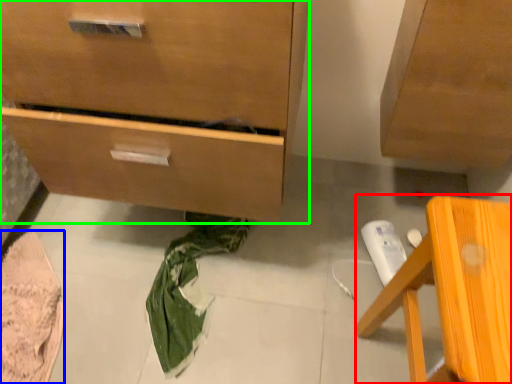
Question: Which object is the farthest from furniture (highlighted by a red box)? Choose among these: material (highlighted by a blue box) or chest of drawers (highlighted by a green box).

Choices:
 (A) material
 (B) chest of drawers

Answer: (A)